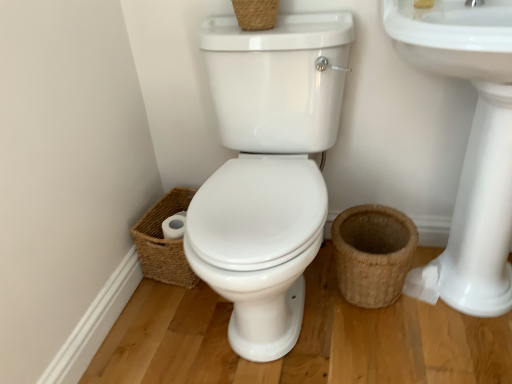
Question: Would you say white glossy sink at upper right, which appears as the second sink when viewed from the right, is to the left or to the right of woven brown basket at upper center, arranged as the 2th basket when viewed from the left, in the picture?

Choices:
 (A) right
 (B) left

Answer: (A)

Question: In terms of height, does white glossy sink at upper right, which appears as the second sink when viewed from the right, look taller or shorter compared to woven brown basket at upper center, which is the 2th basket in right-to-left order?

Choices:
 (A) tall
 (B) short

Answer: (A)

Question: Which object is positioned closest to the white glossy sink at upper right, which appears as the second sink when viewed from the right?

Choices:
 (A) white ceramic sink at right, positioned as the first sink in right-to-left order
 (B) woven brown basket at upper center, the 1th basket in the top-to-bottom sequence
 (C) brown woven basket at lower right, which ranks as the 3th basket in top-to-bottom order
 (D) woven brown basket at lower left, the second basket when ordered from bottom to top

Answer: (C)

Question: Estimate the real-world distances between objects in this image. Which object is farther from the woven brown basket at upper center, arranged as the 2th basket when viewed from the left?

Choices:
 (A) white glossy sink at upper right, the first sink in the left-to-right sequence
 (B) woven brown basket at lower left, acting as the first basket starting from the left
 (C) brown woven basket at lower right, which appears as the 3th basket when viewed from the left
 (D) white ceramic sink at right, positioned as the first sink in right-to-left order

Answer: (B)